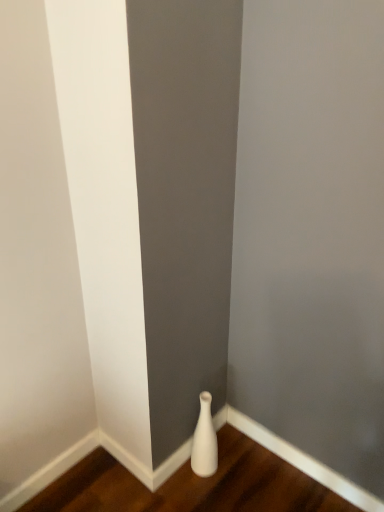
Question: Considering the positions of shiny brown hardwood at lower center and white matte vase at lower right in the image, is shiny brown hardwood at lower center wider or thinner than white matte vase at lower right?

Choices:
 (A) wide
 (B) thin

Answer: (A)

Question: Would you say shiny brown hardwood at lower center is inside or outside white matte vase at lower right?

Choices:
 (A) inside
 (B) outside

Answer: (B)

Question: From the image's perspective, is shiny brown hardwood at lower center above or below white matte vase at lower right?

Choices:
 (A) above
 (B) below

Answer: (B)

Question: Visually, is white matte vase at lower right positioned to the left or to the right of shiny brown hardwood at lower center?

Choices:
 (A) left
 (B) right

Answer: (B)

Question: Relative to shiny brown hardwood at lower center, is white matte vase at lower right in front or behind?

Choices:
 (A) behind
 (B) front

Answer: (A)

Question: From their relative heights in the image, would you say white matte vase at lower right is taller or shorter than shiny brown hardwood at lower center?

Choices:
 (A) tall
 (B) short

Answer: (A)

Question: Is white matte vase at lower right bigger or smaller than shiny brown hardwood at lower center?

Choices:
 (A) small
 (B) big

Answer: (A)